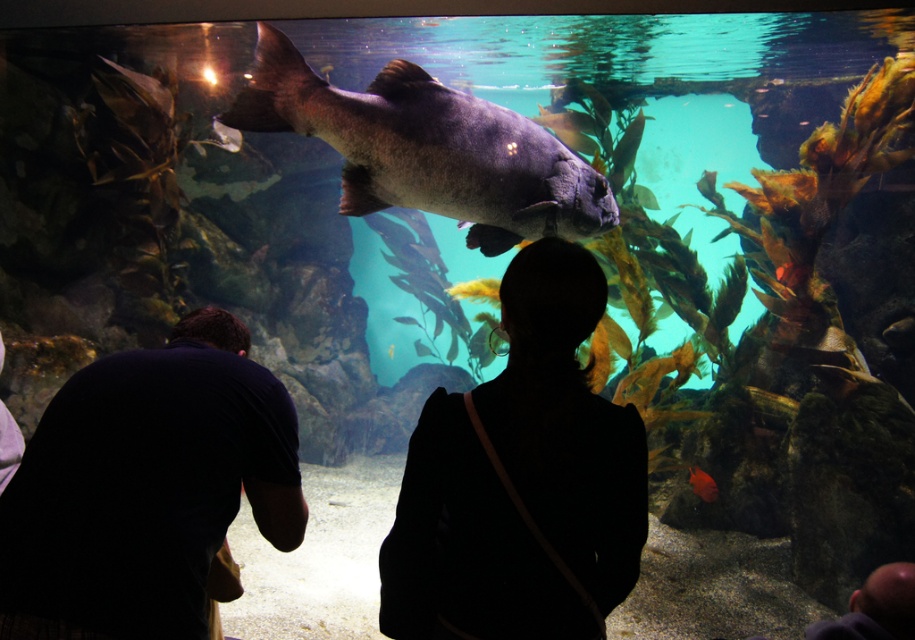
Question: Does dark blue shirt at lower left have a smaller size compared to shiny silver fish at center?

Choices:
 (A) no
 (B) yes

Answer: (A)

Question: Which point is closer to the camera?

Choices:
 (A) shiny dark blue fish at center
 (B) shiny silver fish at center

Answer: (A)

Question: Estimate the real-world distances between objects in this image. Which object is closer to the black fabric at center?

Choices:
 (A) orange matte fish at center
 (B) shiny dark blue fish at center
 (C) shiny silver fish at center
 (D) dark blue shirt at lower left

Answer: (D)

Question: Which of the following is the farthest from the observer?

Choices:
 (A) (420, 326)
 (B) (142, 465)

Answer: (A)

Question: Considering the relative positions of dark blue shirt at lower left and shiny dark blue fish at center in the image provided, where is dark blue shirt at lower left located with respect to shiny dark blue fish at center?

Choices:
 (A) below
 (B) above

Answer: (A)

Question: Is black fabric at center further to the viewer compared to shiny silver fish at center?

Choices:
 (A) yes
 (B) no

Answer: (B)